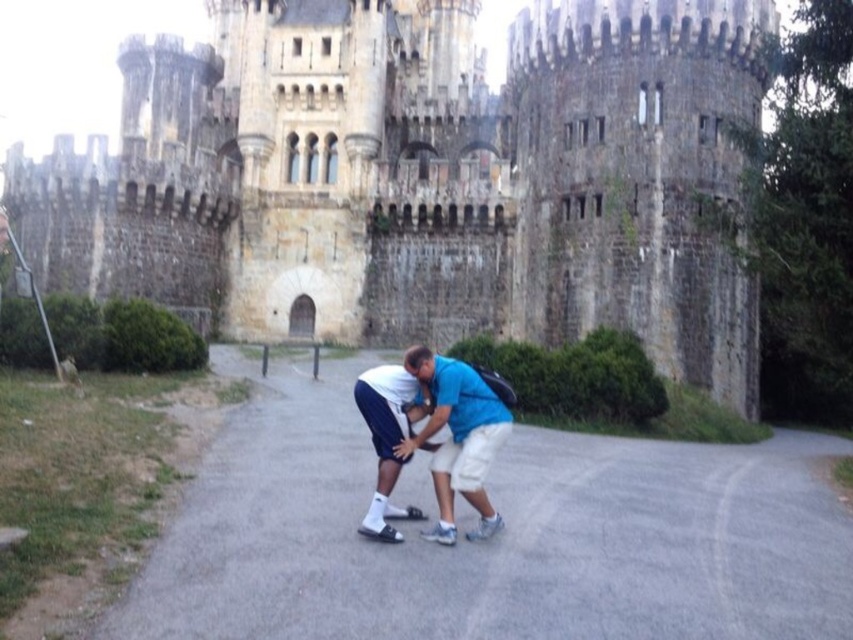
Is blue cotton shirt at center above white matte shorts at center?

Indeed, blue cotton shirt at center is positioned over white matte shorts at center.

Describe the element at coordinates (450, 432) in the screenshot. I see `blue cotton shirt at center` at that location.

Where is `blue cotton shirt at center`? Image resolution: width=853 pixels, height=640 pixels. blue cotton shirt at center is located at coordinates (450, 432).

Image resolution: width=853 pixels, height=640 pixels. I want to click on blue cotton shirt at center, so click(x=450, y=432).

Is stone castle at center above white matte shorts at center?

Yes.

Does point (473, 24) come behind point (376, 464)?

Yes.

Is point (136, 99) positioned behind point (374, 522)?

Yes, point (136, 99) is farther from viewer.

What are the coordinates of `stone castle at center` in the screenshot? It's located at [x=422, y=177].

Does stone castle at center appear under blue cotton shirt at center?

No.

Which is above, stone castle at center or blue cotton shirt at center?

stone castle at center is higher up.

Identify the location of stone castle at center. (422, 177).